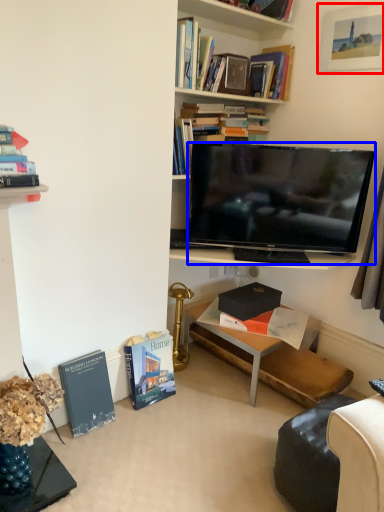
Question: Which of the following is the closest to the observer, picture frame (highlighted by a red box) or television (highlighted by a blue box)?

Choices:
 (A) picture frame
 (B) television

Answer: (A)